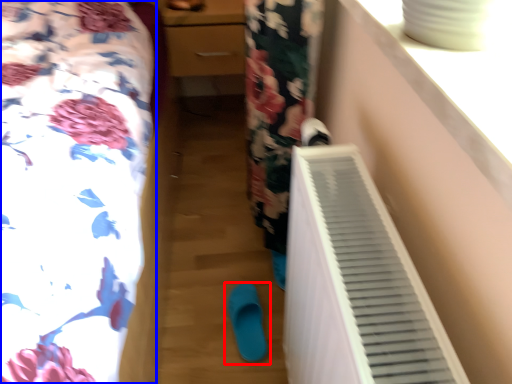
Question: Which object appears farthest to the camera in this image, footwear (highlighted by a red box) or furniture (highlighted by a blue box)?

Choices:
 (A) footwear
 (B) furniture

Answer: (A)